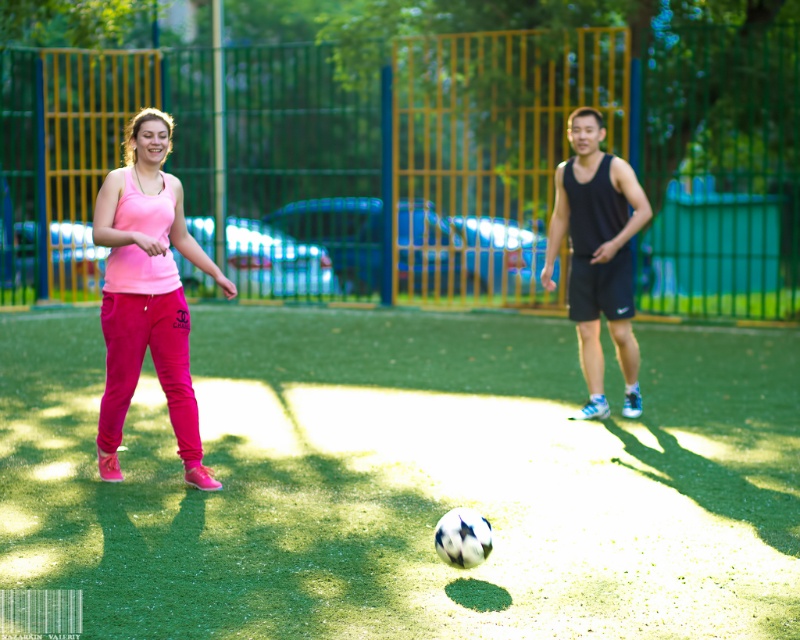
Looking at this image, you are standing at the point marked by the coordinates point [408,480] in the image. What is the color of the ground beneath your feet?

The point [408,480] marks green artificial turf at center, so the ground beneath your feet is green.

You are a photographer standing at the back of the field. You want to take a photo that includes both the green artificial turf at center and the pink fabric pants at left. Which object will appear larger in your photo?

The green artificial turf at center will appear larger in the photo because it is closer to the viewer than the pink fabric pants at left.